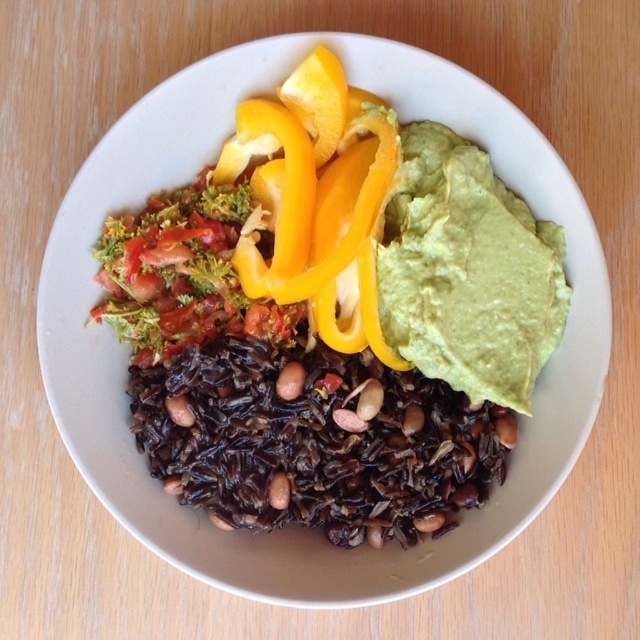
You are standing 3 feet away from the wooden surface where the bowl is placed. You want to grab the yellow matte pepper at center. Can you reach it without moving closer?

The distance between the yellow matte pepper at center and the viewer is 4.08 feet. Since you are currently 3 feet away from the wooden surface, you are closer than the required distance. Therefore, you can reach the yellow matte pepper at center without moving closer.

You are a food stylist trying to arrange a photo shoot. The camera is positioned to the left of the bowl. You want to ensure that the green creamy guacamole at upper right and the brown matte bean at center are both visible in the shot. Given their current positions and distance, will the guacamole and the bean be in frame if the camera captures an area 12 inches wide?

The green creamy guacamole at upper right is 12.26 inches from the brown matte bean at center. Since the distance between them exceeds the 12 inch frame width, the camera might not capture both in the same shot unless adjusted.

Based on the photo, you are a food stylist arranging ingredients in a bowl. You have the green creamy guacamole at upper right and the brown matte bean at center. According to the image, where should you place the guacamole relative to the bean?

The green creamy guacamole at upper right should be placed above the brown matte bean at center as it is located above it in the image.